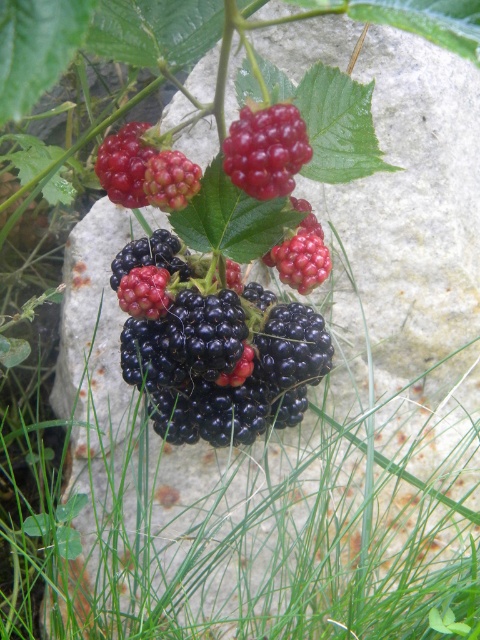
You are a bird looking for berries to eat. You see the shiny black berries at center and the shiny red berries at center. Which berries are located lower in the image?

The shiny black berries at center are located below the shiny red berries at center, so they are lower in the image.